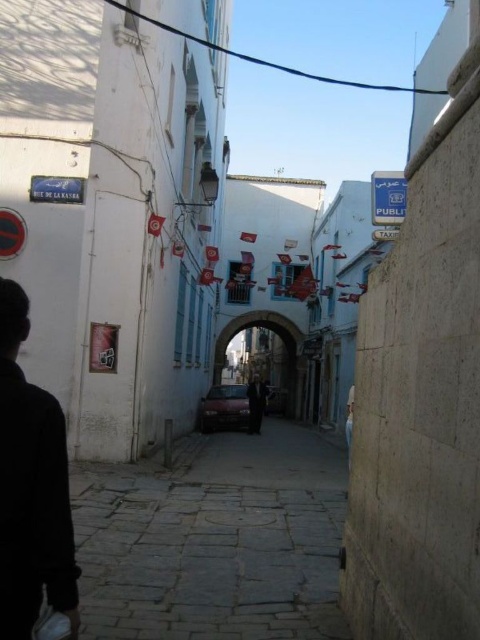
Question: Which of the following is the closest to the observer?

Choices:
 (A) matte red car at center
 (B) smooth stone alley at center
 (C) blue painted stone archway at center
 (D) dark suit at center

Answer: (B)

Question: Is matte red car at center to the right of blue plastic sign at upper center from the viewer's perspective?

Choices:
 (A) yes
 (B) no

Answer: (B)

Question: Does blue painted stone archway at center have a smaller size compared to blue plastic sign at upper center?

Choices:
 (A) no
 (B) yes

Answer: (B)

Question: Can you confirm if blue painted stone archway at center is positioned below dark suit at center?

Choices:
 (A) no
 (B) yes

Answer: (A)

Question: Estimate the real-world distances between objects in this image. Which object is closer to the smooth stone alley at center?

Choices:
 (A) black matte jacket at lower left
 (B) dark suit at center

Answer: (A)

Question: Which point appears closest to the camera in this image?

Choices:
 (A) (0, 323)
 (B) (84, 552)
 (C) (231, 321)

Answer: (A)